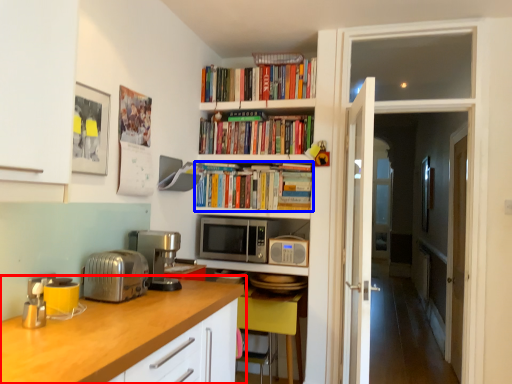
Question: Which point is further to the camera, countertop (highlighted by a red box) or book (highlighted by a blue box)?

Choices:
 (A) countertop
 (B) book

Answer: (B)